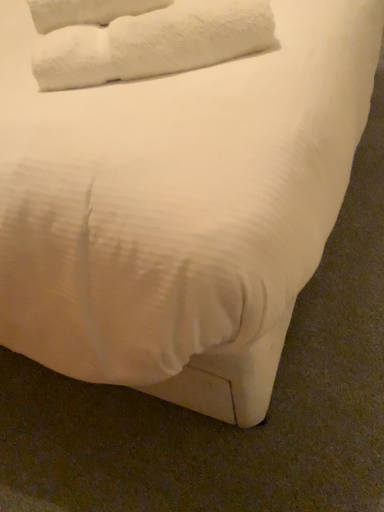
Image resolution: width=384 pixels, height=512 pixels. Describe the element at coordinates (142, 38) in the screenshot. I see `white fluffy towel at upper left` at that location.

The width and height of the screenshot is (384, 512). In order to click on white fluffy towel at upper left in this screenshot , I will do `click(142, 38)`.

Locate an element on the screen. Image resolution: width=384 pixels, height=512 pixels. white fluffy towel at upper left is located at coordinates (x=142, y=38).